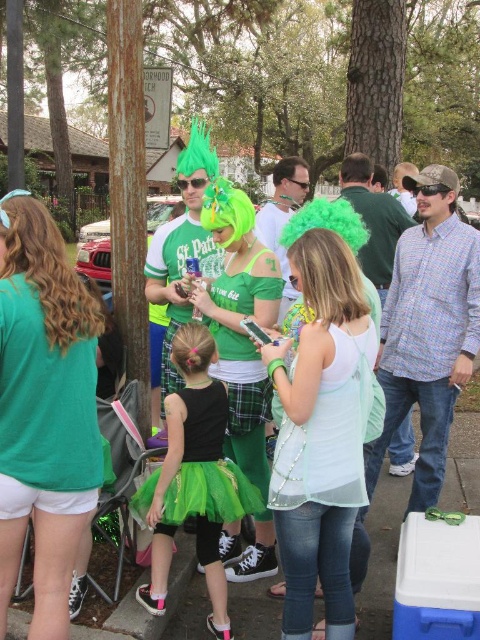
Question: Which of the following is the closest to the observer?

Choices:
 (A) (262, 492)
 (B) (324, 445)
 (C) (354, 627)

Answer: (B)

Question: In this image, where is light green mesh tank top at center located relative to green tulle tutu at center?

Choices:
 (A) above
 (B) below

Answer: (A)

Question: Which point appears closest to the camera in this image?

Choices:
 (A) (327, 372)
 (B) (49, 470)
 (C) (259, 358)

Answer: (B)

Question: Which point appears farthest from the camera in this image?

Choices:
 (A) (32, 355)
 (B) (215, 605)
 (C) (237, 458)

Answer: (C)

Question: Does green tulle tutu at center appear over matte green t-shirt at left?

Choices:
 (A) no
 (B) yes

Answer: (A)

Question: Can you confirm if matte green t-shirt at left is wider than mint sheer dress at center?

Choices:
 (A) yes
 (B) no

Answer: (B)